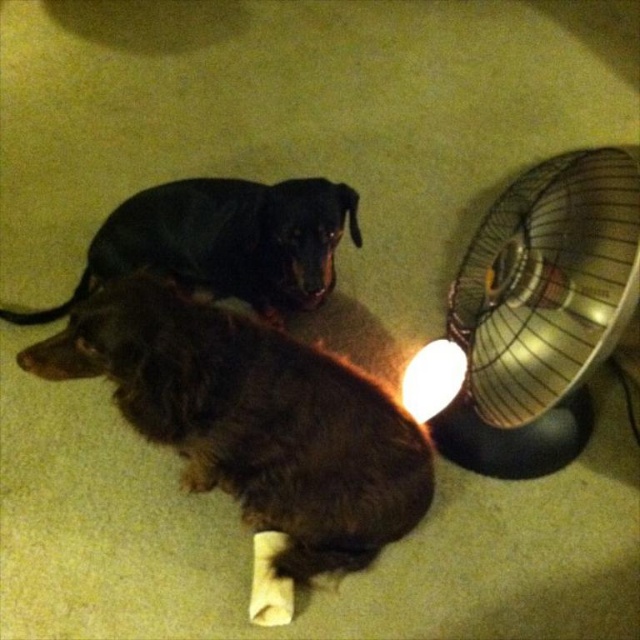
You are a photographer standing in front of the scene. You want to take a photo of the brown fuzzy dog at lower left and the metallic gold fan at right. Which object will appear larger in your photo?

The brown fuzzy dog at lower left will appear larger in the photo because it is closer to the viewer than the metallic gold fan at right.

You are a photographer setting up a shoot with the brown fuzzy dog at lower left and the black smooth dog at upper center. You want to ensure both dogs are visible in the frame. Based on their positions, which dog should you focus on first to capture both in the shot?

The brown fuzzy dog at lower left is below the black smooth dog at upper center, so you should focus on the black smooth dog at upper center first to ensure both are in the frame.

You are a photographer standing in front of the black smooth dog at upper center and the white glossy lampshade at lower right. You want to take a clear photo of both subjects. Which subject should you focus on first to ensure both are in focus?

You should focus on the black smooth dog at upper center first because it is closer to you than the white glossy lampshade at lower right. By focusing on the closer subject, the background subject will also be in focus due to the depth of field.